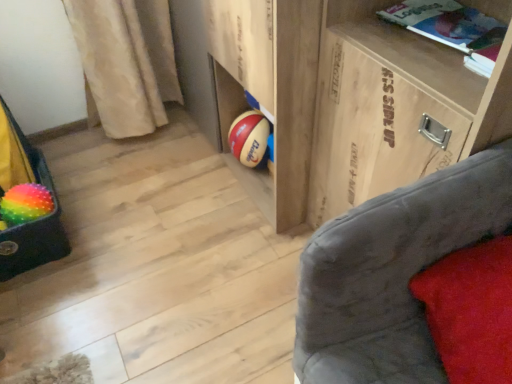
Where is `vacant area on the back side of rainbow fuzzy bean bag chair at left`? vacant area on the back side of rainbow fuzzy bean bag chair at left is located at coordinates (84, 178).